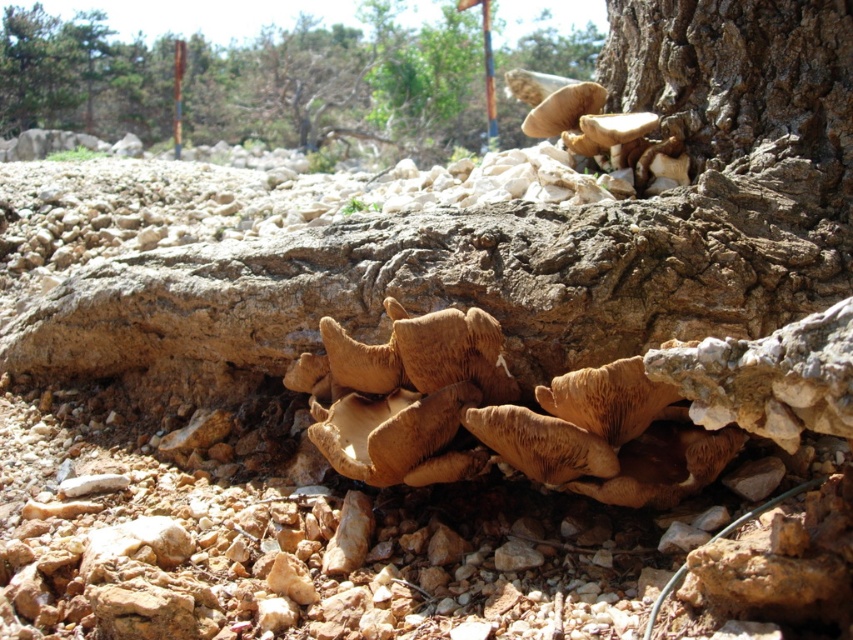
Question: Is brown textured mushrooms at lower right positioned in front of brown leathery fungi at center?

Choices:
 (A) yes
 (B) no

Answer: (B)

Question: Which of the following is the closest to the observer?

Choices:
 (A) (509, 141)
 (B) (320, 323)

Answer: (B)

Question: Which point is closer to the camera?

Choices:
 (A) (387, 312)
 (B) (345, 35)

Answer: (A)

Question: Is brown textured mushrooms at lower right to the right of brown leathery fungi at center from the viewer's perspective?

Choices:
 (A) no
 (B) yes

Answer: (A)

Question: Does brown textured mushrooms at lower right appear over brown leathery fungi at center?

Choices:
 (A) no
 (B) yes

Answer: (B)